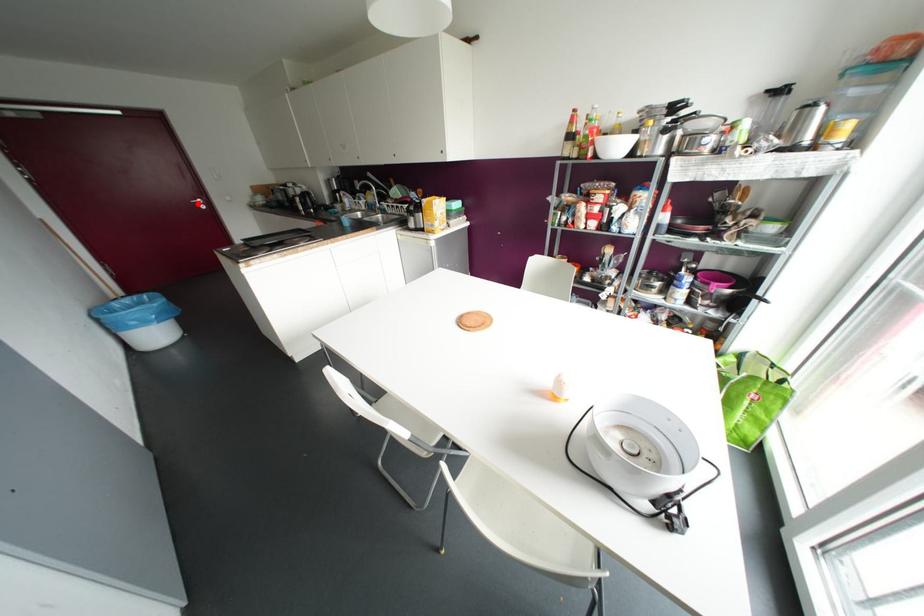
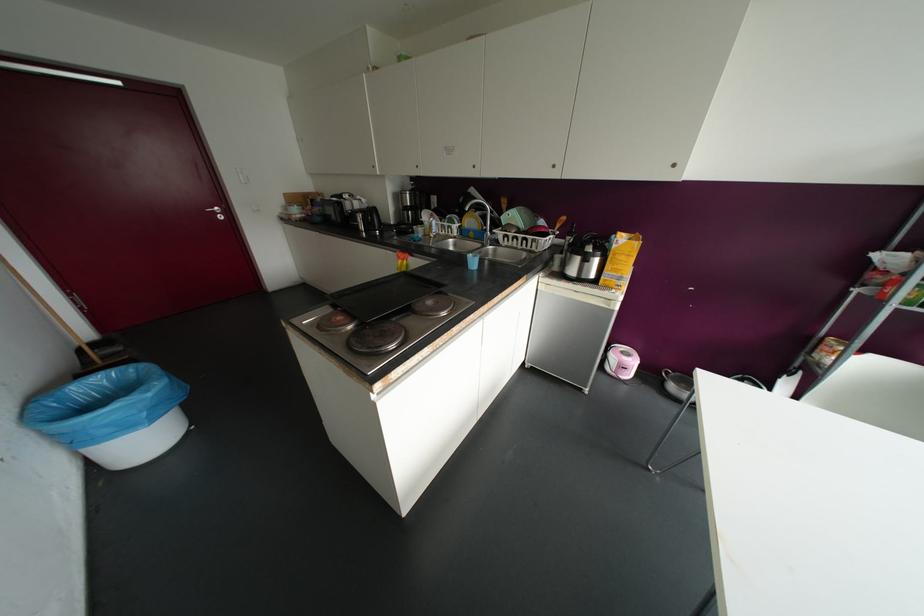
In the second image, find the point that corresponds to the highlighted location in the first image.

(214, 213)